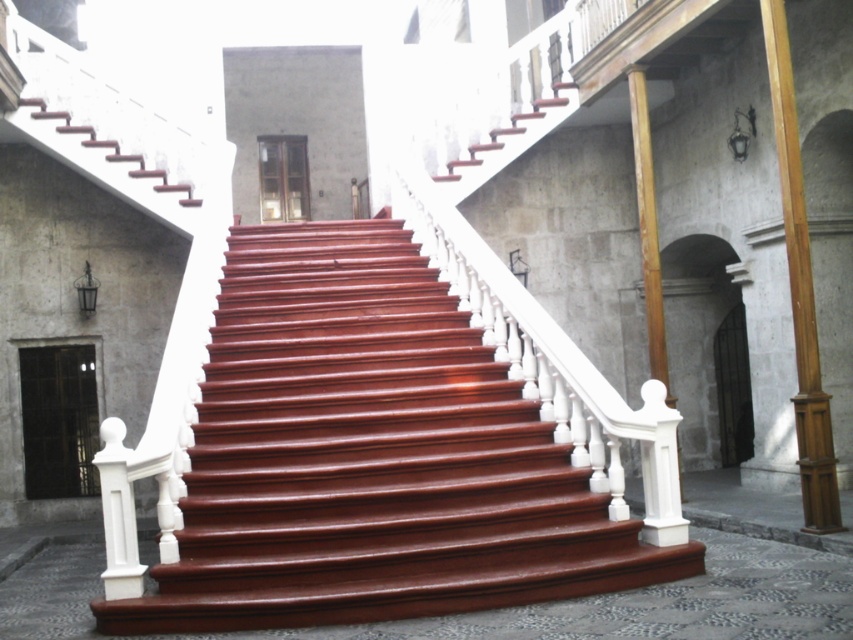
Question: Is shiny wood stairs at center further to the viewer compared to wooden post at right?

Choices:
 (A) no
 (B) yes

Answer: (A)

Question: Is shiny wood stairs at center above wooden post at right?

Choices:
 (A) yes
 (B) no

Answer: (B)

Question: Can you confirm if shiny wood stairs at center is positioned below wooden post at right?

Choices:
 (A) yes
 (B) no

Answer: (A)

Question: Which point is closer to the camera taking this photo?

Choices:
 (A) (801, 477)
 (B) (192, 579)

Answer: (B)